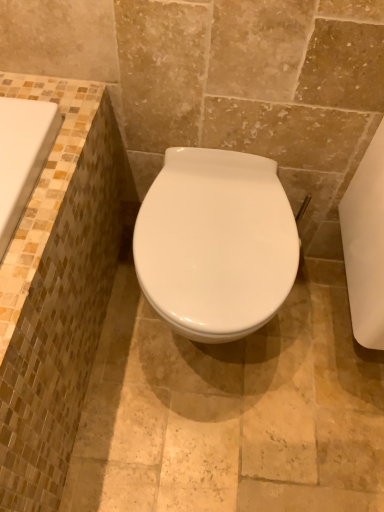
Where is `vacant space situated above white glossy toilet at center (from a real-world perspective)`? This screenshot has width=384, height=512. vacant space situated above white glossy toilet at center (from a real-world perspective) is located at coordinates (205, 225).